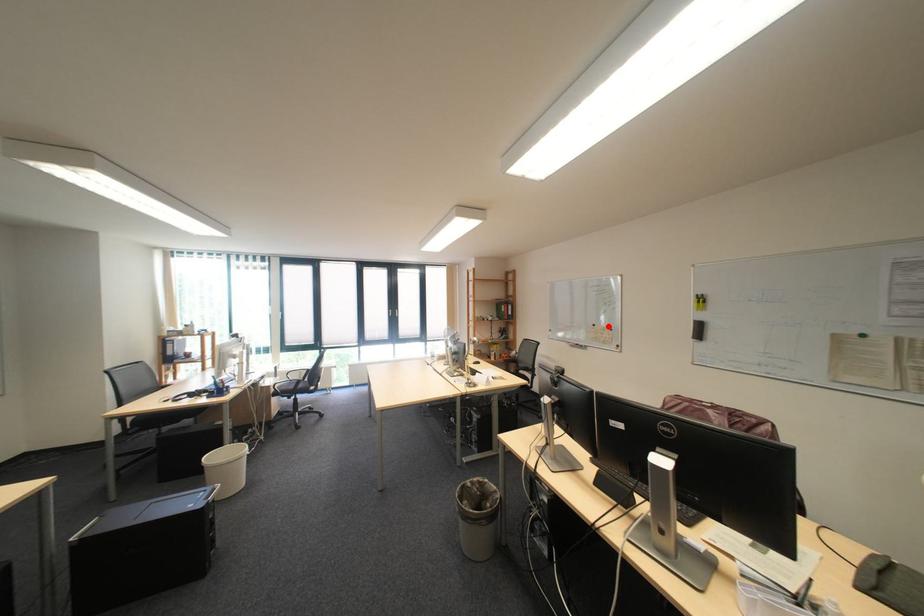
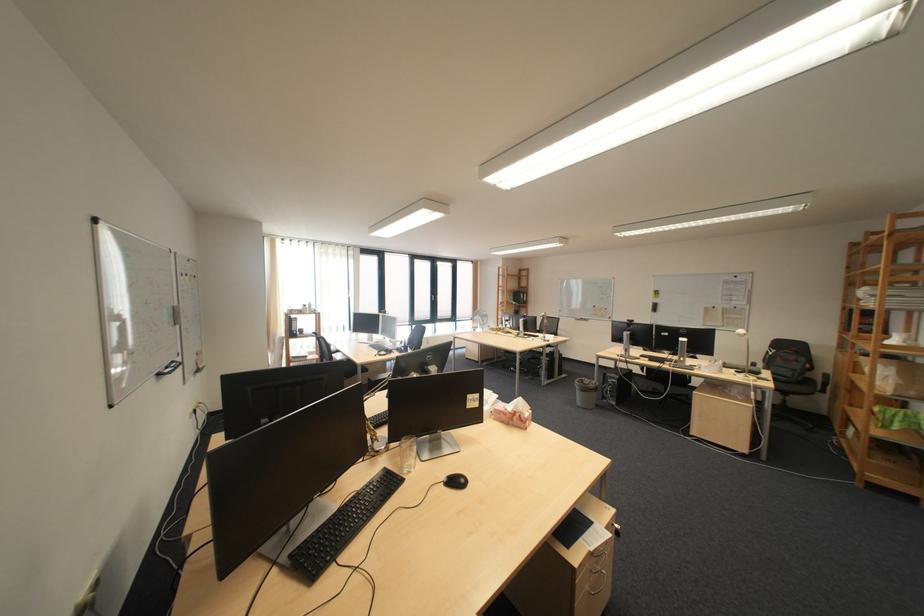
Question: I am providing you with two images of the same scene from different viewpoints. In image1, a red point is highlighted. Considering the same 3D point in image2, which of the following is correct?

Choices:
 (A) It is closer
 (B) It is farther

Answer: (B)